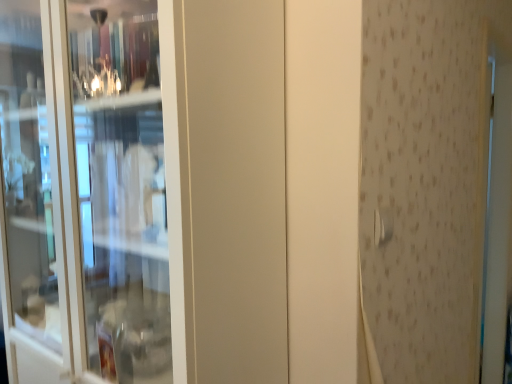
Image resolution: width=512 pixels, height=384 pixels. Find the location of `satin silver door handle at upper right`. satin silver door handle at upper right is located at coordinates (383, 226).

What do you see at coordinates (383, 226) in the screenshot?
I see `satin silver door handle at upper right` at bounding box center [383, 226].

Describe the element at coordinates (84, 193) in the screenshot. The width and height of the screenshot is (512, 384). I see `transparent glass screen door at left` at that location.

What are the coordinates of `transparent glass screen door at left` in the screenshot? It's located at (84, 193).

Where is `satin silver door handle at upper right`? This screenshot has width=512, height=384. satin silver door handle at upper right is located at coordinates (383, 226).

Considering the relative positions of satin silver door handle at upper right and transparent glass screen door at left in the image provided, is satin silver door handle at upper right to the right of transparent glass screen door at left from the viewer's perspective?

Yes, satin silver door handle at upper right is to the right of transparent glass screen door at left.

Looking at this image, which object is closer to the camera taking this photo, satin silver door handle at upper right or transparent glass screen door at left?

transparent glass screen door at left is in front.

Considering the points (392, 216) and (75, 217), which point is behind, point (392, 216) or point (75, 217)?

The point (392, 216) is more distant.

From the image's perspective, is satin silver door handle at upper right beneath transparent glass screen door at left?

Yes.

From a real-world perspective, is satin silver door handle at upper right below transparent glass screen door at left?

No, from a real-world perspective, satin silver door handle at upper right is not under transparent glass screen door at left.

Which of these two, satin silver door handle at upper right or transparent glass screen door at left, is thinner?

With smaller width is satin silver door handle at upper right.

Considering the sizes of satin silver door handle at upper right and transparent glass screen door at left in the image, is satin silver door handle at upper right taller or shorter than transparent glass screen door at left?

Considering their sizes, satin silver door handle at upper right has less height than transparent glass screen door at left.

Can you confirm if satin silver door handle at upper right is smaller than transparent glass screen door at left?

Correct, satin silver door handle at upper right occupies less space than transparent glass screen door at left.

Is satin silver door handle at upper right outside of transparent glass screen door at left?

Yes, satin silver door handle at upper right is located beyond the bounds of transparent glass screen door at left.

Can you see satin silver door handle at upper right touching transparent glass screen door at left?

No, satin silver door handle at upper right is not next to transparent glass screen door at left.

Is satin silver door handle at upper right positioned with its back to transparent glass screen door at left?

Yes, satin silver door handle at upper right's orientation is away from transparent glass screen door at left.

Measure the distance from satin silver door handle at upper right to transparent glass screen door at left.

A distance of 28.85 inches exists between satin silver door handle at upper right and transparent glass screen door at left.

Find the location of a particular element. This screenshot has width=512, height=384. door handle on the right of transparent glass screen door at left is located at coordinates (383, 226).

Is transparent glass screen door at left to the right of satin silver door handle at upper right from the viewer's perspective?

Incorrect, transparent glass screen door at left is not on the right side of satin silver door handle at upper right.

Which is in front, transparent glass screen door at left or satin silver door handle at upper right?

transparent glass screen door at left is closer to the camera.

Which is more distant, [134,278] or [391,237]?

Positioned behind is point [134,278].

Consider the image. From the image's perspective, which object appears higher, transparent glass screen door at left or satin silver door handle at upper right?

transparent glass screen door at left, from the image's perspective.

From a real-world perspective, is transparent glass screen door at left positioned under satin silver door handle at upper right based on gravity?

Correct, in the physical world, transparent glass screen door at left is lower than satin silver door handle at upper right.

Which object is wider, transparent glass screen door at left or satin silver door handle at upper right?

transparent glass screen door at left.

Is transparent glass screen door at left taller or shorter than satin silver door handle at upper right?

Considering their sizes, transparent glass screen door at left has more height than satin silver door handle at upper right.

Does transparent glass screen door at left have a larger size compared to satin silver door handle at upper right?

Yes, transparent glass screen door at left is bigger than satin silver door handle at upper right.

Is satin silver door handle at upper right a part of transparent glass screen door at left?

Actually, satin silver door handle at upper right is outside transparent glass screen door at left.

Are transparent glass screen door at left and satin silver door handle at upper right located far from each other?

transparent glass screen door at left is near satin silver door handle at upper right, not far away.

Is satin silver door handle at upper right at the back of transparent glass screen door at left?

No, transparent glass screen door at left's orientation is not away from satin silver door handle at upper right.

Can you tell me how much transparent glass screen door at left and satin silver door handle at upper right differ in facing direction?

The facing directions of transparent glass screen door at left and satin silver door handle at upper right are 88.2 degrees apart.

At what (x,y) coordinates should I click in order to perform the action: click on screen door lying above the satin silver door handle at upper right (from the image's perspective). Please return your answer as a coordinate pair (x, y). This screenshot has width=512, height=384. Looking at the image, I should click on (84, 193).

In the image, there is a satin silver door handle at upper right. What are the coordinates of `screen door below it (from a real-world perspective)` in the screenshot? It's located at (84, 193).

At what (x,y) coordinates should I click in order to perform the action: click on door handle behind the transparent glass screen door at left. Please return your answer as a coordinate pair (x, y). Looking at the image, I should click on (383, 226).